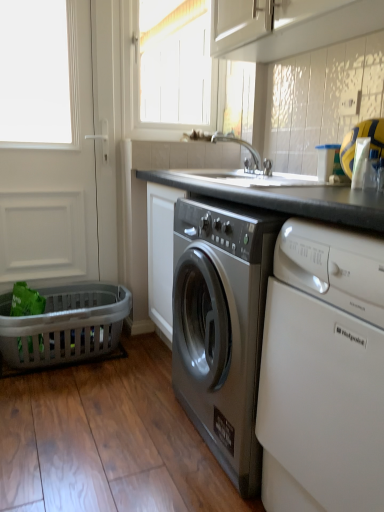
Question: Considering the relative sizes of white matte screen door at left and white wood window at upper center in the image provided, is white matte screen door at left thinner than white wood window at upper center?

Choices:
 (A) yes
 (B) no

Answer: (B)

Question: Is white matte screen door at left aimed at white wood window at upper center?

Choices:
 (A) no
 (B) yes

Answer: (A)

Question: Can you confirm if white matte screen door at left is smaller than white wood window at upper center?

Choices:
 (A) yes
 (B) no

Answer: (B)

Question: Does white matte screen door at left have a lesser height compared to white wood window at upper center?

Choices:
 (A) yes
 (B) no

Answer: (B)

Question: Is white matte screen door at left wider than white wood window at upper center?

Choices:
 (A) yes
 (B) no

Answer: (A)

Question: Considering the positions of black granite countertop at center and white glossy cabinet at upper center in the image, is black granite countertop at center wider or thinner than white glossy cabinet at upper center?

Choices:
 (A) wide
 (B) thin

Answer: (A)

Question: Considering the positions of point (342, 373) and point (347, 60), is point (342, 373) closer or farther from the camera than point (347, 60)?

Choices:
 (A) farther
 (B) closer

Answer: (B)

Question: From a real-world perspective, relative to white glossy cabinet at upper center, is black granite countertop at center vertically above or below?

Choices:
 (A) below
 (B) above

Answer: (A)

Question: From the image's perspective, relative to white glossy cabinet at upper center, is black granite countertop at center above or below?

Choices:
 (A) below
 (B) above

Answer: (A)

Question: From a real-world perspective, relative to white glossy dishwasher at right, is black granite countertop at center vertically above or below?

Choices:
 (A) above
 (B) below

Answer: (B)

Question: Considering the positions of black granite countertop at center and white glossy dishwasher at right in the image, is black granite countertop at center bigger or smaller than white glossy dishwasher at right?

Choices:
 (A) small
 (B) big

Answer: (B)

Question: From the image's perspective, is black granite countertop at center above or below white glossy dishwasher at right?

Choices:
 (A) above
 (B) below

Answer: (A)

Question: Based on their positions, is black granite countertop at center located to the left or right of white glossy dishwasher at right?

Choices:
 (A) left
 (B) right

Answer: (A)

Question: Visually, is black granite countertop at center positioned to the left or to the right of white matte screen door at left?

Choices:
 (A) right
 (B) left

Answer: (A)

Question: In the image, is black granite countertop at center positioned in front of or behind white matte screen door at left?

Choices:
 (A) behind
 (B) front

Answer: (B)